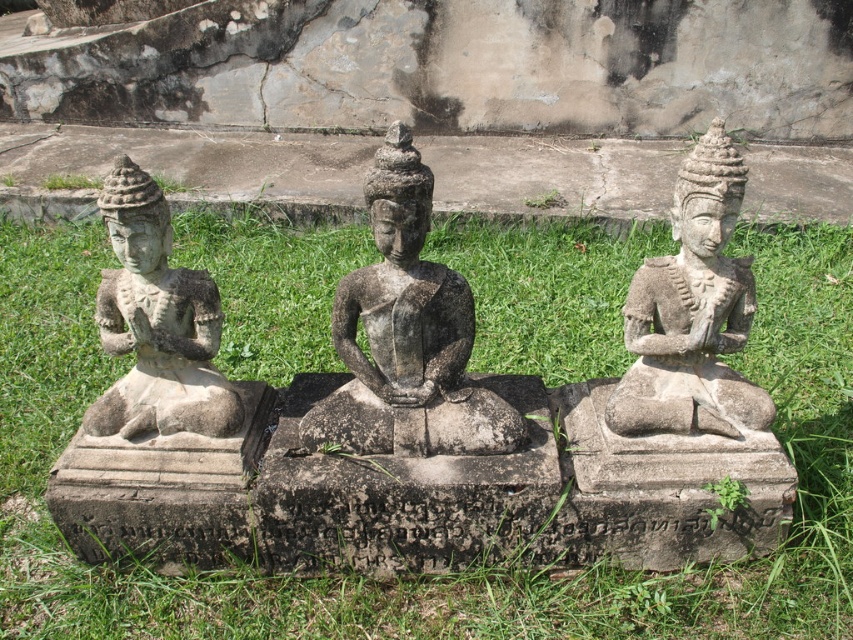
You are a gardener who wants to mow the green grass at center and the gray stone statue at left. Which one should you mow first if you want to start from the shorter one?

The gray stone statue at left is shorter than the green grass at center, so you should mow the green grass at center first since it is taller.